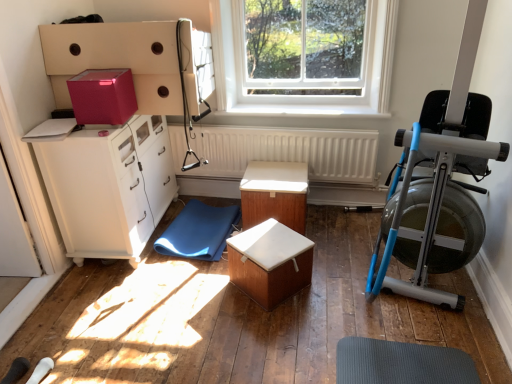
Question: Can you confirm if blue metallic rowing machine at right is wider than transparent glass window at upper center?

Choices:
 (A) no
 (B) yes

Answer: (B)

Question: Considering the relative sizes of blue metallic rowing machine at right and transparent glass window at upper center in the image provided, is blue metallic rowing machine at right bigger than transparent glass window at upper center?

Choices:
 (A) no
 (B) yes

Answer: (B)

Question: Considering the relative sizes of blue metallic rowing machine at right and transparent glass window at upper center in the image provided, is blue metallic rowing machine at right thinner than transparent glass window at upper center?

Choices:
 (A) yes
 (B) no

Answer: (B)

Question: Would you consider blue metallic rowing machine at right to be distant from transparent glass window at upper center?

Choices:
 (A) no
 (B) yes

Answer: (A)

Question: Considering the relative sizes of blue metallic rowing machine at right and transparent glass window at upper center in the image provided, is blue metallic rowing machine at right shorter than transparent glass window at upper center?

Choices:
 (A) yes
 (B) no

Answer: (B)

Question: Is wooden box at center, the first table viewed from the front, taller or shorter than blue metallic rowing machine at right?

Choices:
 (A) short
 (B) tall

Answer: (A)

Question: Would you say wooden box at center, marked as the second table in a back-to-front arrangement, is inside or outside blue metallic rowing machine at right?

Choices:
 (A) outside
 (B) inside

Answer: (A)

Question: In terms of width, does wooden box at center, marked as the second table in a back-to-front arrangement, look wider or thinner when compared to blue metallic rowing machine at right?

Choices:
 (A) wide
 (B) thin

Answer: (B)

Question: Is wooden box at center, the first table viewed from the front, bigger or smaller than blue metallic rowing machine at right?

Choices:
 (A) small
 (B) big

Answer: (A)

Question: Considering the positions of white smooth window sill at center and blue metallic rowing machine at right in the image, is white smooth window sill at center taller or shorter than blue metallic rowing machine at right?

Choices:
 (A) short
 (B) tall

Answer: (A)

Question: Looking at their shapes, would you say white smooth window sill at center is wider or thinner than blue metallic rowing machine at right?

Choices:
 (A) thin
 (B) wide

Answer: (A)

Question: Choose the correct answer: Is white smooth window sill at center inside blue metallic rowing machine at right or outside it?

Choices:
 (A) inside
 (B) outside

Answer: (B)

Question: Considering their positions, is white smooth window sill at center located in front of or behind blue metallic rowing machine at right?

Choices:
 (A) front
 (B) behind

Answer: (B)

Question: Do you think pink matte cardboard box at upper left is within white matte radiator at center, or outside of it?

Choices:
 (A) inside
 (B) outside

Answer: (B)

Question: Considering the positions of pink matte cardboard box at upper left and white matte radiator at center in the image, is pink matte cardboard box at upper left bigger or smaller than white matte radiator at center?

Choices:
 (A) small
 (B) big

Answer: (A)